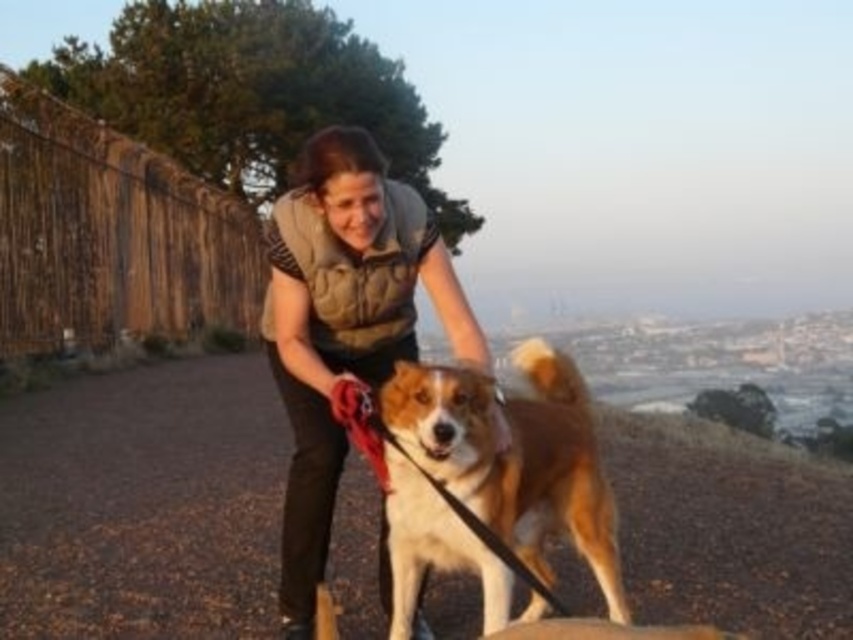
Looking at this image, you are a photographer trying to capture both the brown fur dog at center and the brown and white fur at center in the same frame. Since you want to ensure both are clearly visible, which of the two should you focus on first to account for their sizes?

The brown fur dog at center is bigger than brown and white fur at center, so you should focus on the brown fur dog at center first to ensure its details are sharp before adjusting for the smaller one.

You are a hiker who wants to take a photo of the brown and white fur at center and the matte brown vest at center. Which object should you focus on first if you want to capture both in the same frame without moving your camera?

The matte brown vest at center is to the left of brown and white fur at center, so you should focus on the matte brown vest at center first to ensure both are in the frame.

You are a photographer trying to capture the brown fur dog at center and the brown and white fur at center in the same frame. Which one should you focus on first if you want to ensure both are in focus?

The brown fur dog at center is taller than the brown and white fur at center, so focusing on the taller one first would help ensure both are in focus.